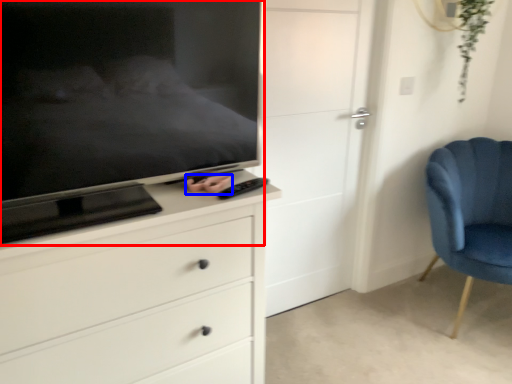
Question: Which object appears farthest to the camera in this image, television (highlighted by a red box) or hand (highlighted by a blue box)?

Choices:
 (A) television
 (B) hand

Answer: (B)